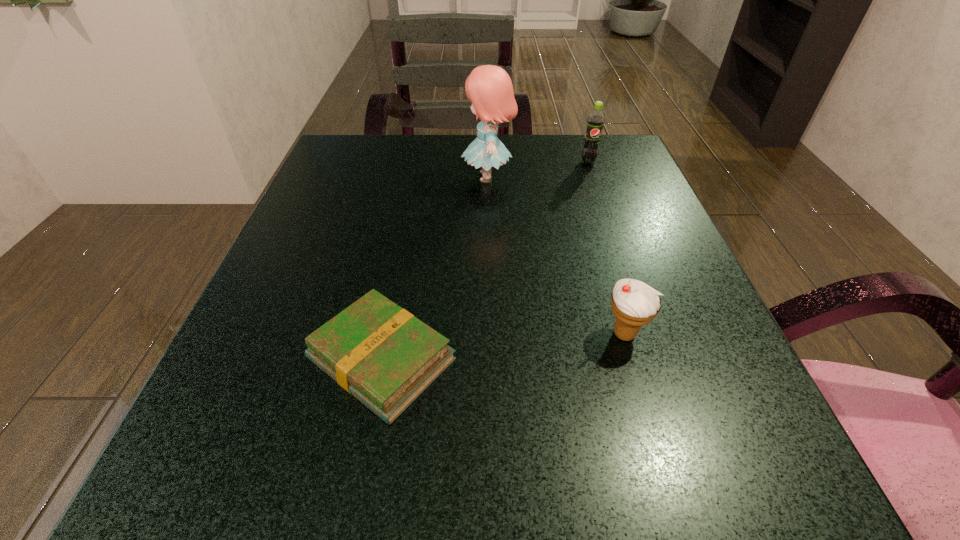
Find the location of `vacant space that satisfies the following two spatial constraints: 1. on the front label of the soda; 2. on the front-facing side of the doll`. vacant space that satisfies the following two spatial constraints: 1. on the front label of the soda; 2. on the front-facing side of the doll is located at coordinates [x=593, y=177].

This screenshot has width=960, height=540. I want to click on free location that satisfies the following two spatial constraints: 1. on the back side of the third tallest object; 2. on the front-facing side of the doll, so click(x=578, y=177).

This screenshot has height=540, width=960. In order to click on free space that satisfies the following two spatial constraints: 1. on the back side of the icecream; 2. on the front-facing side of the doll in this screenshot , I will do `click(578, 177)`.